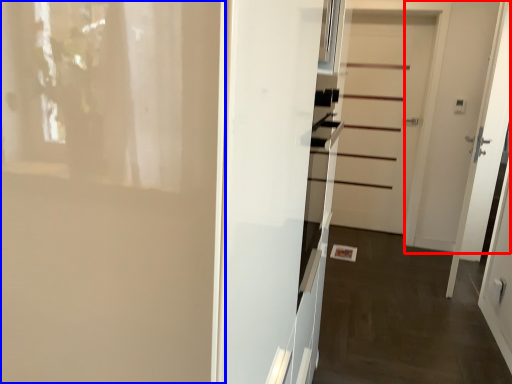
Question: Which object is further to the camera taking this photo, door (highlighted by a red box) or door (highlighted by a blue box)?

Choices:
 (A) door
 (B) door

Answer: (A)